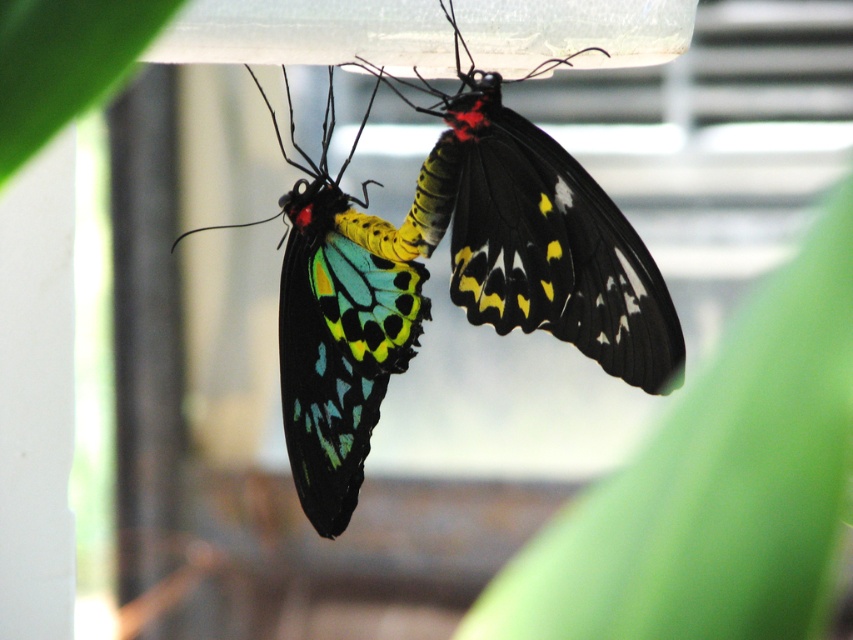
You are a biologist observing the butterflies and their environment. You notice the shiny iridescent wings at center and the green leafy plant at upper left. Which object is positioned higher in the image?

The shiny iridescent wings at center is much taller as green leafy plant at upper left, so the shiny iridescent wings at center is positioned higher in the image.

You are an entomologist observing two butterflies under a container. You notice a green matte leaf at upper right and multicolored iridescent wings at center. Which object is located to the left of the other?

The green matte leaf at upper right is positioned on the left side of multicolored iridescent wings at center.

You are an entomologist observing the butterflies. You need to compare the sizes of the green matte leaf at upper right and the multicolored iridescent wings at center. Which one is wider?

The green matte leaf at upper right is less than the multicolored iridescent wings at center in width, so the multicolored iridescent wings at center are wider.